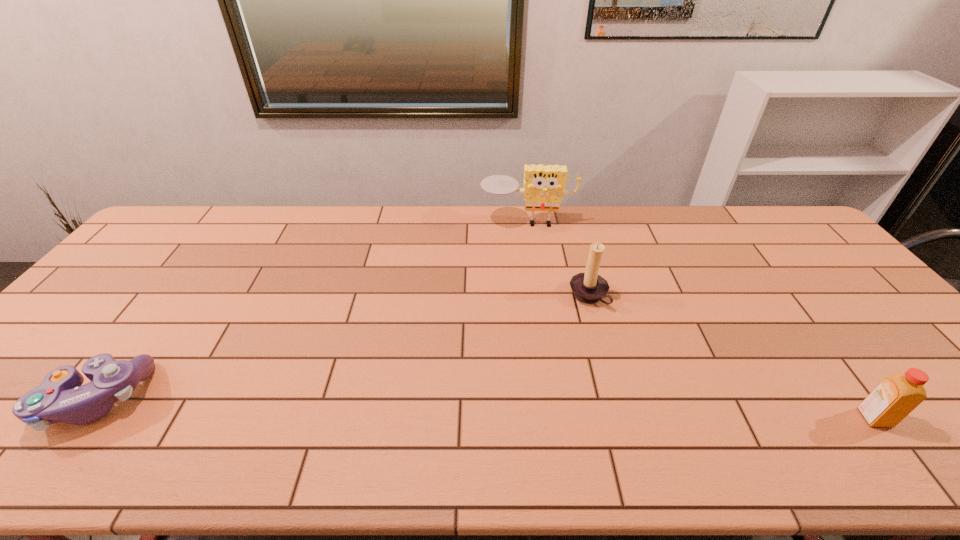
Locate an element on the screen. Image resolution: width=960 pixels, height=540 pixels. free space on the desktop that is between the leftmost object and the second shortest object and is positioned on the wick of the third nearest object is located at coordinates (378, 406).

Find the location of a particular element. The width and height of the screenshot is (960, 540). free space on the desktop that is between the control and the rightmost object and is positioned on the front-facing side of the sponge is located at coordinates (538, 410).